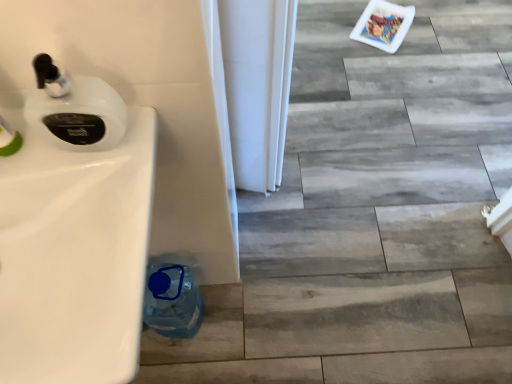
The height and width of the screenshot is (384, 512). Find the location of `free space above white glossy sink at left (from a real-world perspective)`. free space above white glossy sink at left (from a real-world perspective) is located at coordinates (93, 219).